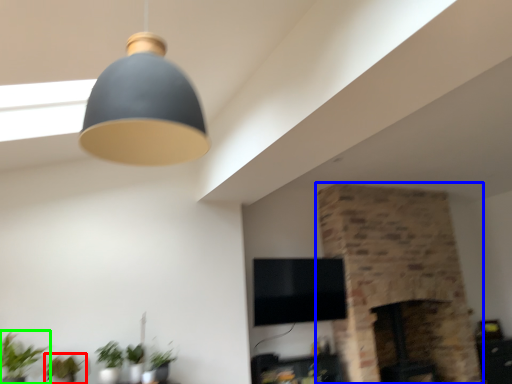
Question: Considering the real-world distances, which object is closest to plant (highlighted by a red box)? fireplace (highlighted by a blue box) or houseplant (highlighted by a green box).

Choices:
 (A) fireplace
 (B) houseplant

Answer: (B)